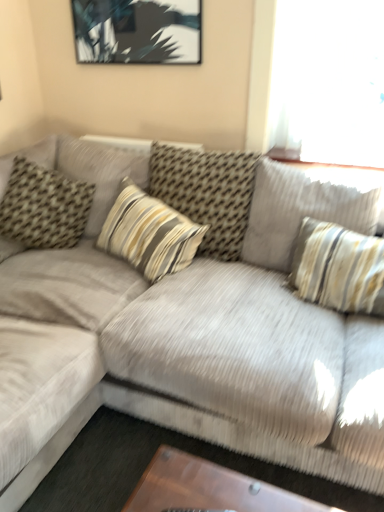
Question: From the image's perspective, is striped fabric pillow at center, the second pillow in the right-to-left sequence, above or below brown textured pillow at left, positioned as the fourth pillow in right-to-left order?

Choices:
 (A) below
 (B) above

Answer: (B)

Question: Is striped fabric pillow at center, which is the third pillow in left-to-right order, taller or shorter than brown textured pillow at left, positioned as the fourth pillow in right-to-left order?

Choices:
 (A) tall
 (B) short

Answer: (A)

Question: Considering the real-world distances, which object is closest to the striped fabric pillow at upper right, the fourth pillow from the left?

Choices:
 (A) striped fabric pillow at center, the second pillow in the right-to-left sequence
 (B) striped fabric pillow at center, acting as the 3th pillow starting from the right
 (C) velvet beige couch at center
 (D) brown textured pillow at left, positioned as the fourth pillow in right-to-left order

Answer: (A)

Question: Which object is positioned farthest from the striped fabric pillow at center, which ranks as the second pillow in left-to-right order?

Choices:
 (A) striped fabric pillow at upper right, the first pillow in the right-to-left sequence
 (B) striped fabric pillow at center, the second pillow in the right-to-left sequence
 (C) velvet beige couch at center
 (D) brown textured pillow at left, positioned as the fourth pillow in right-to-left order

Answer: (A)